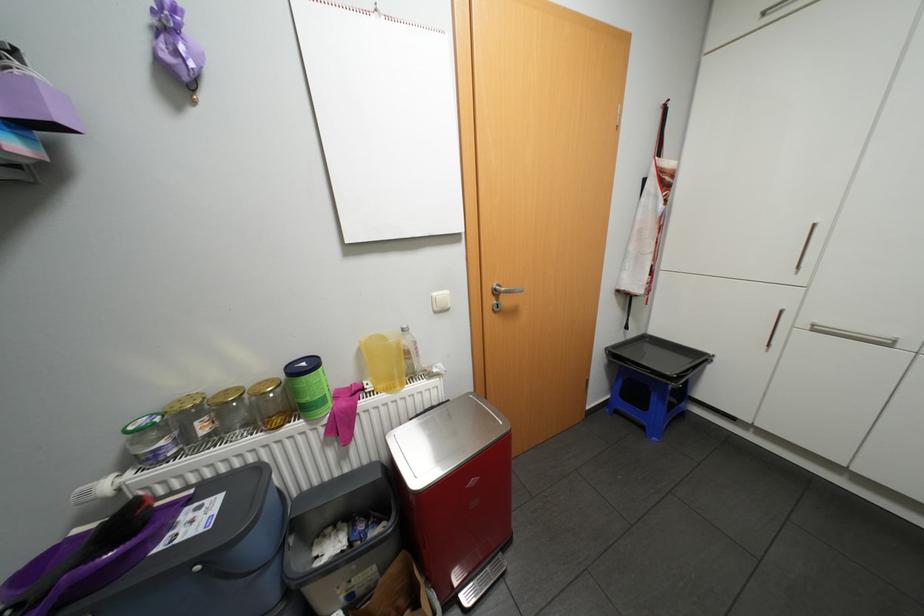
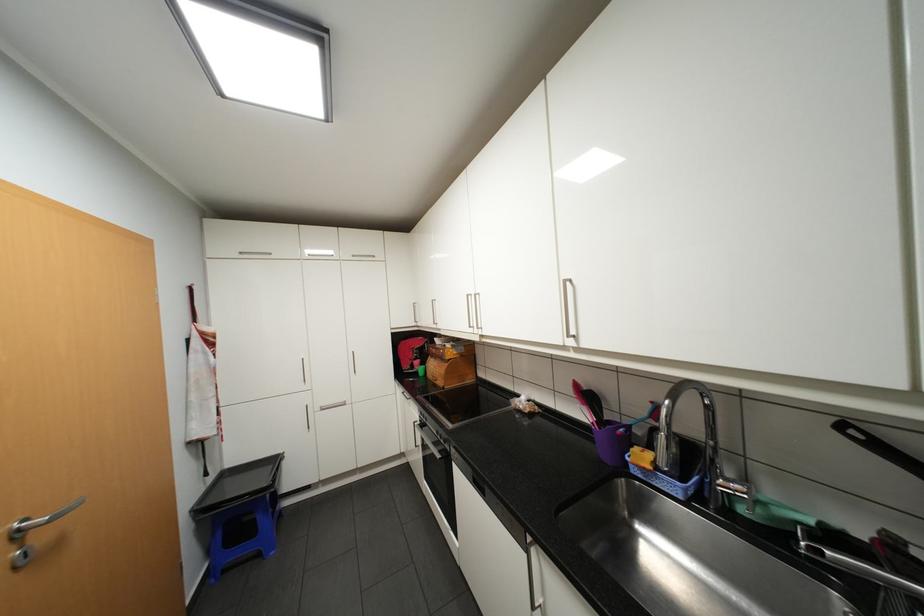
The point at (639,333) is marked in the first image. Where is the corresponding point in the second image?

(220, 476)